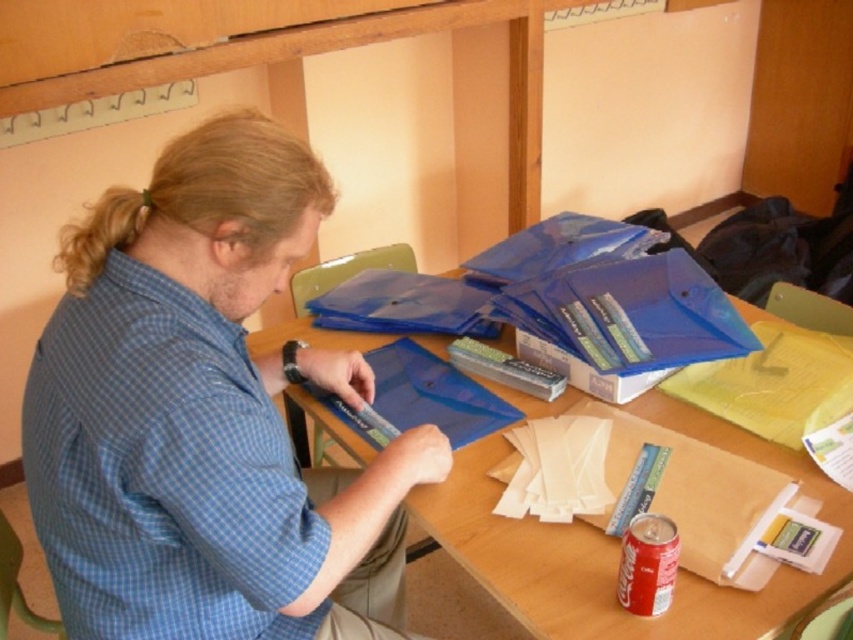
Question: Which point is farther from the camera taking this photo?

Choices:
 (A) (798, 588)
 (B) (196, 525)
 (C) (105, 250)

Answer: (A)

Question: Is translucent plastic table at center wider than white matte paper at lower center?

Choices:
 (A) yes
 (B) no

Answer: (A)

Question: Which object appears closest to the camera in this image?

Choices:
 (A) translucent plastic table at center
 (B) white matte paper at lower center
 (C) blue matte folder at center
 (D) blonde hair at upper left

Answer: (C)

Question: Among these points, which one is nearest to the camera?

Choices:
 (A) (395, 253)
 (B) (543, 476)
 (C) (91, 269)

Answer: (C)

Question: Is translucent plastic table at center thinner than white matte paper at lower center?

Choices:
 (A) no
 (B) yes

Answer: (A)

Question: From the image, what is the correct spatial relationship of blue matte folder at center in relation to blonde hair at upper left?

Choices:
 (A) right
 (B) left

Answer: (A)